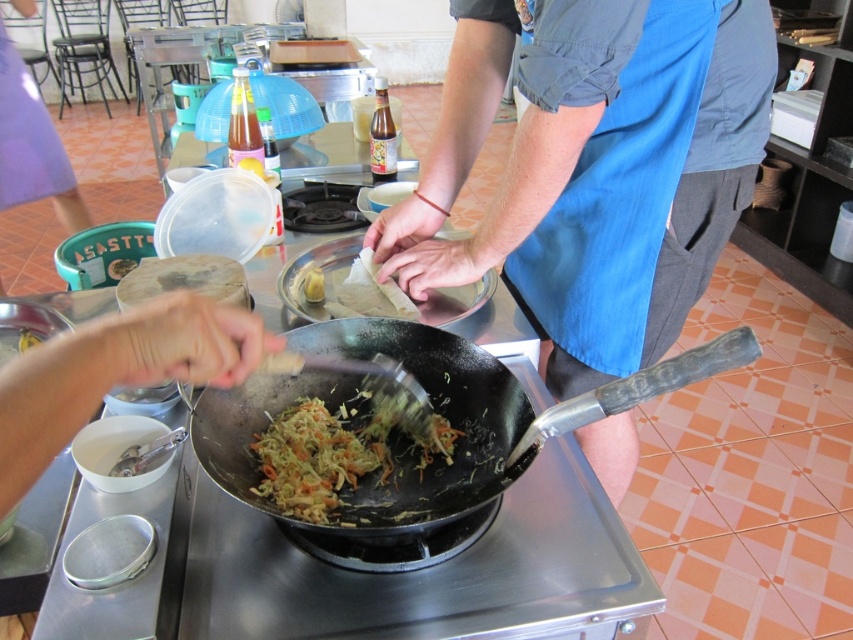
Based on the photo, measure the distance from black non-stick frying pan at center to smooth silver spoon at lower left.

black non-stick frying pan at center is 8.68 inches away from smooth silver spoon at lower left.

Image resolution: width=853 pixels, height=640 pixels. I want to click on black non-stick frying pan at center, so click(436, 412).

Between point (700, 273) and point (468, 348), which one is positioned in front?

Point (468, 348) is more forward.

I want to click on blue fabric apron at center, so click(x=595, y=168).

Between point (763, 42) and point (355, 493), which one is positioned in front?

Point (355, 493) is more forward.

At what (x,y) coordinates should I click in order to perform the action: click on blue fabric apron at center. Please return your answer as a coordinate pair (x, y). The image size is (853, 640). Looking at the image, I should click on (595, 168).

Is black non-stick frying pan at center to the right of shiny brown noodles at center from the viewer's perspective?

Correct, you'll find black non-stick frying pan at center to the right of shiny brown noodles at center.

Where is `black non-stick frying pan at center`? The width and height of the screenshot is (853, 640). black non-stick frying pan at center is located at coordinates (436, 412).

Where is `black non-stick frying pan at center`? The image size is (853, 640). black non-stick frying pan at center is located at coordinates (436, 412).